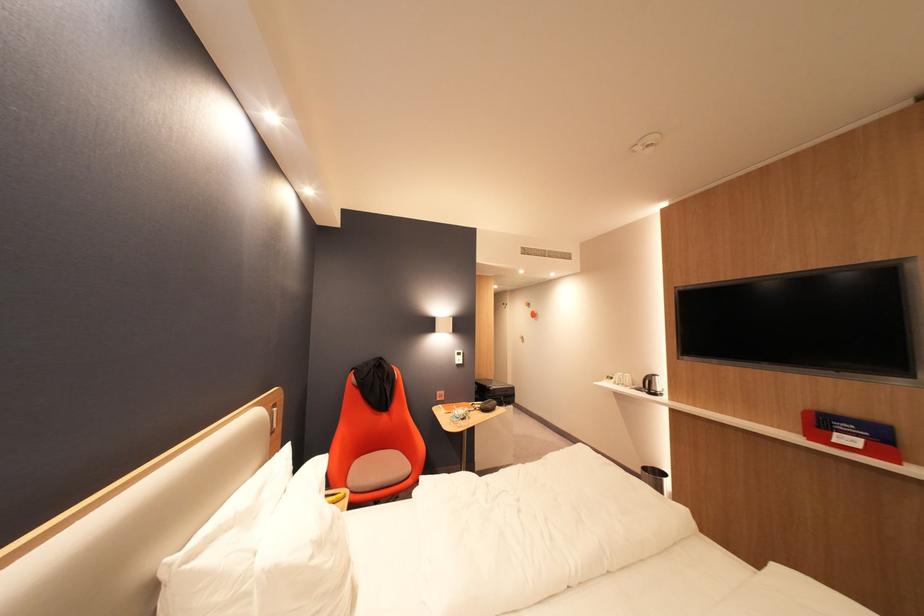
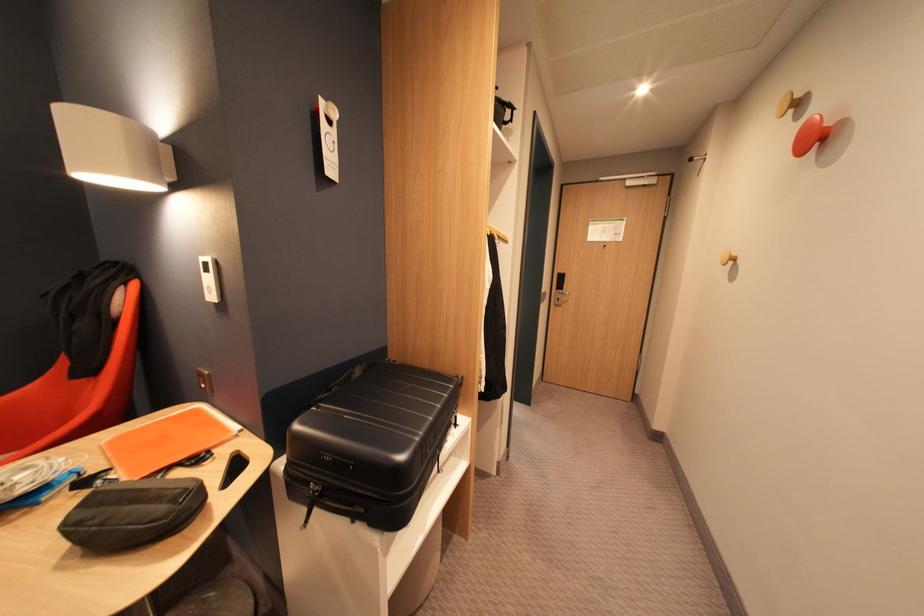
Locate, in the second image, the point that corresponds to point 539,309 in the first image.

(809, 118)